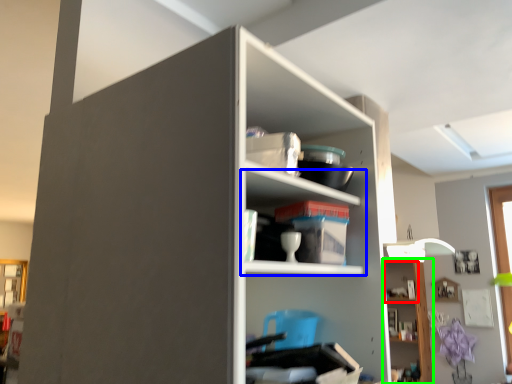
Question: Which is nearer to the cabinet (highlighted by a red box)? shelf (highlighted by a blue box) or shelf (highlighted by a green box).

Choices:
 (A) shelf
 (B) shelf

Answer: (B)